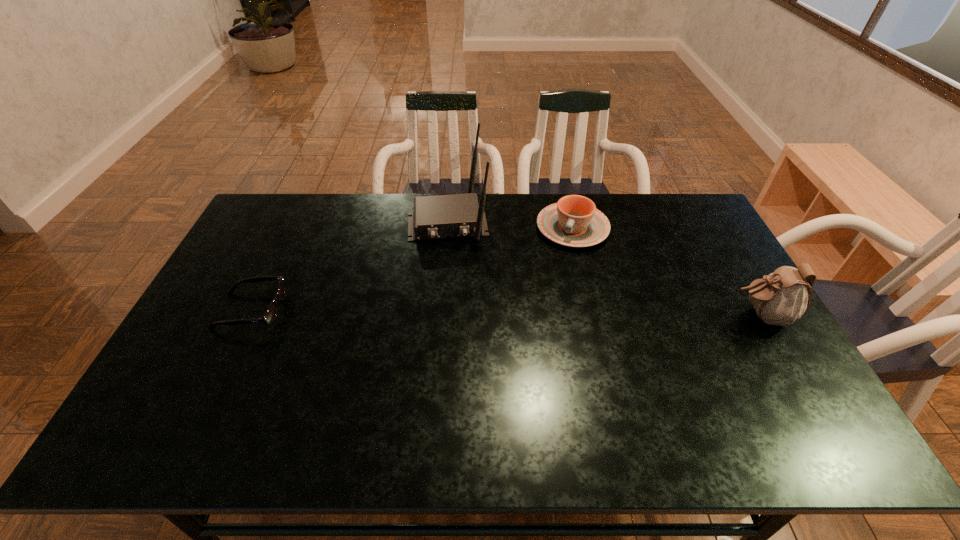
Where is `empty space that is in between the rightmost object and the third object from left to right`? empty space that is in between the rightmost object and the third object from left to right is located at coordinates (666, 272).

Image resolution: width=960 pixels, height=540 pixels. I want to click on unoccupied position between the shortest object and the third object from left to right, so click(412, 269).

You are a GUI agent. You are given a task and a screenshot of the screen. Output one action in this format:
    pyautogui.click(x=<x>, y=<y>)
    Task: Click on the free point between the spectacles and the chinaware
    
    Given the screenshot: What is the action you would take?
    pyautogui.click(x=412, y=269)

Locate an element on the screen. This screenshot has width=960, height=540. free space between the router and the second tallest object is located at coordinates (604, 269).

Find the location of a particular element. The image size is (960, 540). vacant space that's between the second object from left to right and the spectacles is located at coordinates (349, 267).

Locate an element on the screen. This screenshot has width=960, height=540. vacant point located between the second tallest object and the chinaware is located at coordinates (666, 272).

Select which object is the second closest to the second object from left to right. Please provide its 2D coordinates. Your answer should be formatted as a tuple, i.e. [(x, y)], where the tuple contains the x and y coordinates of a point satisfying the conditions above.

[(269, 316)]

Locate which object is the second closest to the spectacles. Please provide its 2D coordinates. Your answer should be formatted as a tuple, i.e. [(x, y)], where the tuple contains the x and y coordinates of a point satisfying the conditions above.

[(574, 221)]

You are a GUI agent. You are given a task and a screenshot of the screen. Output one action in this format:
    pyautogui.click(x=<x>, y=<y>)
    Task: Click on the vacant space that satisfies the following two spatial constraints: 1. on the front side of the tallest object; 2. on the front-facing side of the rightmost object
    The image size is (960, 540).
    Given the screenshot: What is the action you would take?
    pyautogui.click(x=440, y=315)